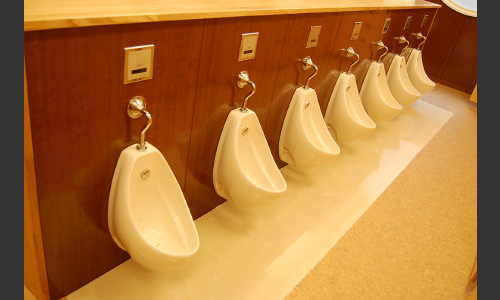
Find the location of a particular element. The width and height of the screenshot is (500, 300). control panels is located at coordinates (134, 55), (250, 45), (312, 33), (358, 30), (387, 27), (409, 23), (424, 19).